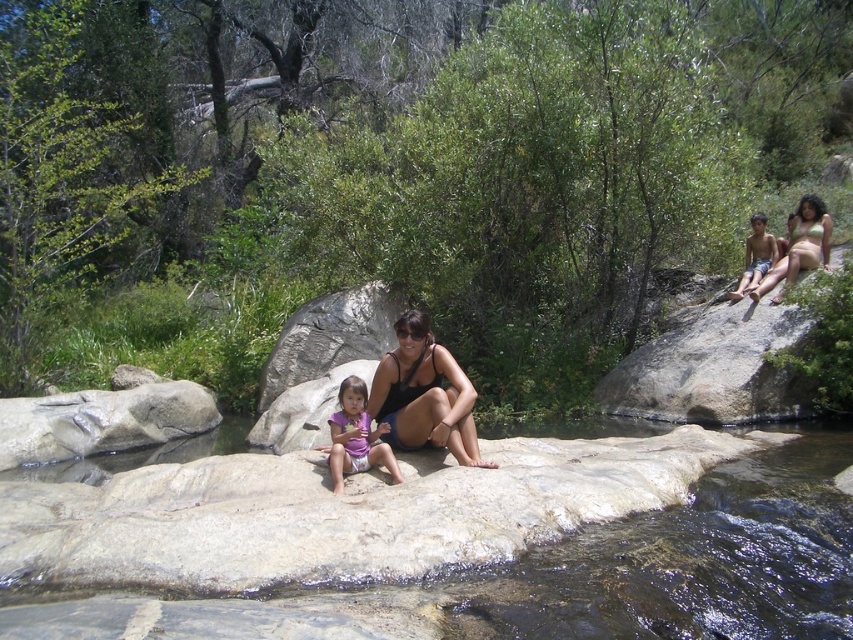
Which of these two, matte black bikini at center or matte black bikini top at upper right, stands shorter?

matte black bikini top at upper right is shorter.

How distant is matte black bikini at center from matte black bikini top at upper right?

matte black bikini at center is 7.89 inches from matte black bikini top at upper right.

Who is more distant from viewer, (817, 212) or (795, 227)?

→ Point (795, 227)

You are a GUI agent. You are given a task and a screenshot of the screen. Output one action in this format:
    pyautogui.click(x=<x>, y=<y>)
    Task: Click on the matte black bikini at center
    
    Given the screenshot: What is the action you would take?
    pyautogui.click(x=799, y=246)

Who is more forward, (685,627) or (746,256)?

Point (685,627) is in front.

Is clear water at rock center further to the viewer compared to light brown skin at upper right?

No, clear water at rock center is in front of light brown skin at upper right.

What do you see at coordinates (695, 561) in the screenshot?
I see `clear water at rock center` at bounding box center [695, 561].

Locate an element on the screen. clear water at rock center is located at coordinates (695, 561).

From the picture: Is matte black swimsuit at center below purple fabric at center?

No, matte black swimsuit at center is not below purple fabric at center.

Is point (469, 397) positioned after point (347, 397)?

That is False.

This screenshot has width=853, height=640. Identify the location of matte black swimsuit at center. (424, 394).